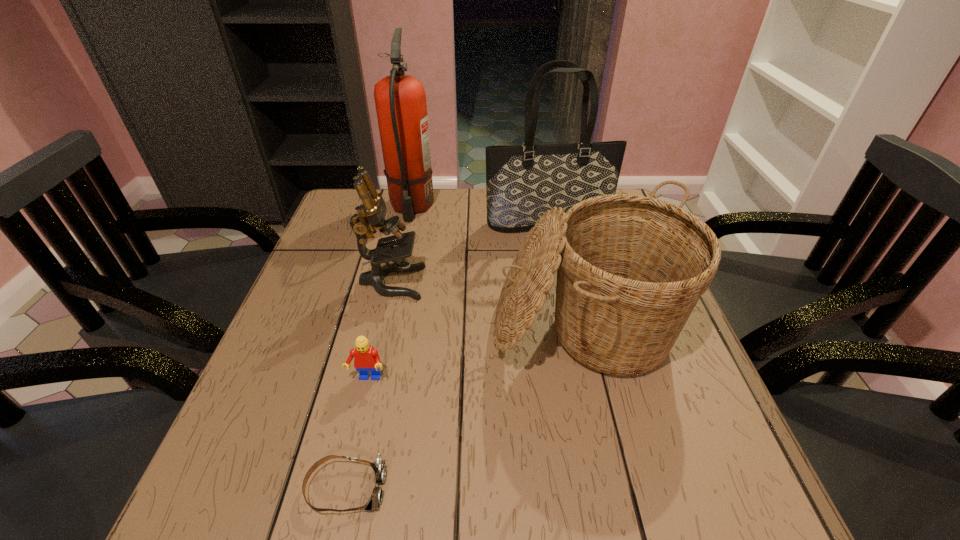
Locate an element on the screen. Image resolution: width=960 pixels, height=540 pixels. vacant space at the near edge of the desktop is located at coordinates (385, 531).

This screenshot has height=540, width=960. I want to click on vacant region at the left edge of the desktop, so click(x=337, y=254).

The width and height of the screenshot is (960, 540). Find the location of `vacant space at the right edge of the desktop`. vacant space at the right edge of the desktop is located at coordinates (635, 388).

In the image, there is a desktop. At what (x,y) coordinates should I click in order to perform the action: click on vacant space at the near right corner. Please return your answer as a coordinate pair (x, y). The width and height of the screenshot is (960, 540). Looking at the image, I should click on (713, 497).

Locate an element on the screen. The image size is (960, 540). empty space that is in between the goggles and the microscope is located at coordinates (369, 385).

This screenshot has height=540, width=960. Identify the location of unoccupied area between the nearest object and the microscope. (369, 385).

Identify the location of vacant point located between the Lego and the tote bag. (458, 301).

The height and width of the screenshot is (540, 960). I want to click on vacant area that lies between the tote bag and the nearest object, so click(x=446, y=356).

Locate an element on the screen. vacant area that lies between the tote bag and the nearest object is located at coordinates coord(446,356).

The width and height of the screenshot is (960, 540). Identify the location of empty location between the Lego and the basket. (476, 356).